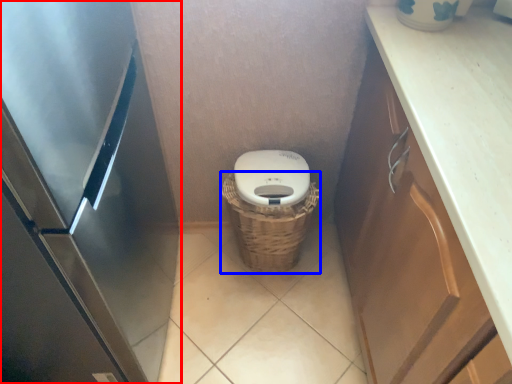
Question: Among these objects, which one is nearest to the camera, appliance (highlighted by a red box) or basket (highlighted by a blue box)?

Choices:
 (A) appliance
 (B) basket

Answer: (A)